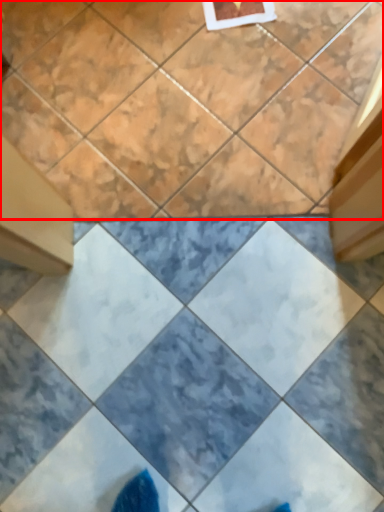
Question: Observing the image, what is the correct spatial positioning of ceramic tile (annotated by the red box) in reference to ceramic tile?

Choices:
 (A) left
 (B) right

Answer: (A)